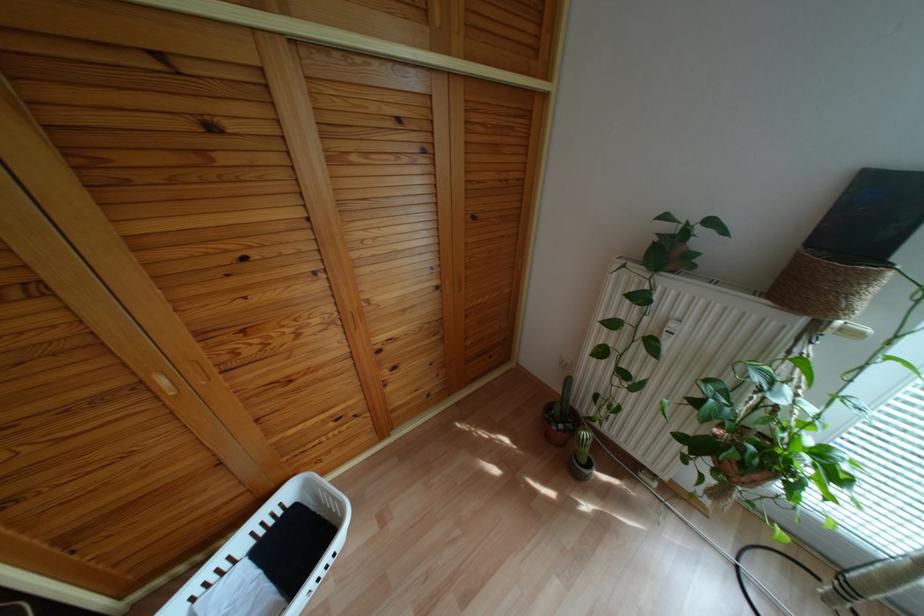
At what (x,y) coordinates should I click in order to perform the action: click on white laundry basket. Please return your answer as a coordinate pair (x, y). This screenshot has height=616, width=924. Looking at the image, I should click on (271, 554).